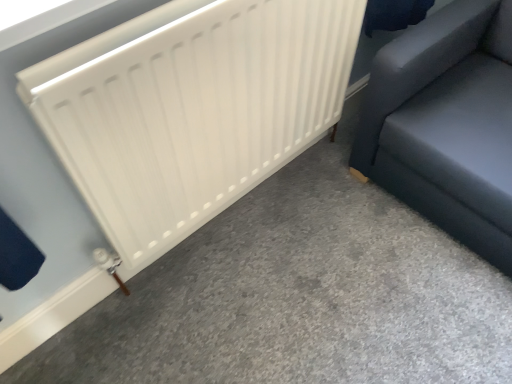
Question: From a real-world perspective, is white matte radiator at left above or below white matte radiator at center?

Choices:
 (A) above
 (B) below

Answer: (B)

Question: Considering the positions of white matte radiator at left and white matte radiator at center in the image, is white matte radiator at left bigger or smaller than white matte radiator at center?

Choices:
 (A) big
 (B) small

Answer: (B)

Question: Which object is the farthest from the white matte radiator at left?

Choices:
 (A) white matte radiator at center
 (B) dark gray fabric sofa at right

Answer: (A)

Question: Which of these objects is positioned closest to the white matte radiator at center?

Choices:
 (A) dark gray fabric sofa at right
 (B) white matte radiator at left

Answer: (A)